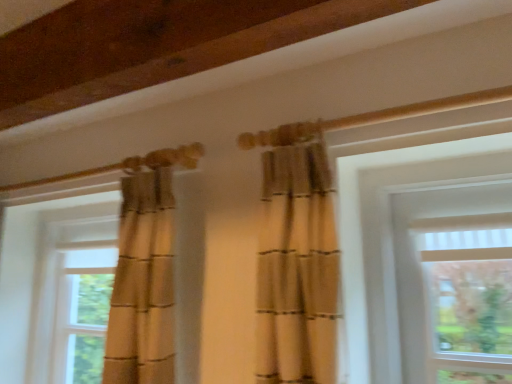
Image resolution: width=512 pixels, height=384 pixels. Describe the element at coordinates (108, 279) in the screenshot. I see `matte beige curtain at left, the 1th window in the right-to-left sequence` at that location.

In order to face matte beige curtain at left, arranged as the second window when viewed from the left, should I rotate leftwards or rightwards?

Turn left by 22.619 degrees to look at matte beige curtain at left, arranged as the second window when viewed from the left.

At what (x,y) coordinates should I click in order to perform the action: click on matte beige curtain at left, arranged as the second window when viewed from the left. Please return your answer as a coordinate pair (x, y). Looking at the image, I should click on (108, 279).

What is the approximate width of matte beige curtain at left, the 1th window in the right-to-left sequence?

matte beige curtain at left, the 1th window in the right-to-left sequence, is 11.33 inches wide.

What is the approximate height of translucent glass window at left, the 2th window viewed from the right?

It is 26.73 inches.

The width and height of the screenshot is (512, 384). I want to click on translucent glass window at left, the 2th window viewed from the right, so click(82, 310).

Image resolution: width=512 pixels, height=384 pixels. What do you see at coordinates (82, 310) in the screenshot?
I see `translucent glass window at left, the 2th window viewed from the right` at bounding box center [82, 310].

Measure the distance between point (80, 269) and camera.

The distance of point (80, 269) from camera is 6.01 feet.

At what (x,y) coordinates should I click in order to perform the action: click on matte beige curtain at left, the 1th window in the right-to-left sequence. Please return your answer as a coordinate pair (x, y). This screenshot has height=384, width=512. Looking at the image, I should click on (108, 279).

Which is more to the left, translucent glass window at left, arranged as the first window when viewed from the left, or matte beige curtain at left, arranged as the second window when viewed from the left?

Positioned to the left is translucent glass window at left, arranged as the first window when viewed from the left.

Which object is further away from the camera, translucent glass window at left, arranged as the first window when viewed from the left, or matte beige curtain at left, the 1th window in the right-to-left sequence?

translucent glass window at left, arranged as the first window when viewed from the left, is further away from the camera.

Is point (91, 313) positioned after point (181, 208)?

Yes, it is behind point (181, 208).

From the image's perspective, is translucent glass window at left, arranged as the first window when viewed from the left, positioned above or below matte beige curtain at left, arranged as the second window when viewed from the left?

translucent glass window at left, arranged as the first window when viewed from the left, is situated lower than matte beige curtain at left, arranged as the second window when viewed from the left, in the image.

From a real-world perspective, which object rests below the other?

translucent glass window at left, the 2th window viewed from the right, from a real-world perspective.

Considering the sizes of objects translucent glass window at left, the 2th window viewed from the right, and matte beige curtain at left, the 1th window in the right-to-left sequence, in the image provided, who is wider, translucent glass window at left, the 2th window viewed from the right, or matte beige curtain at left, the 1th window in the right-to-left sequence,?

Wider between the two is matte beige curtain at left, the 1th window in the right-to-left sequence.

Based on the photo, in terms of height, does translucent glass window at left, arranged as the first window when viewed from the left, look taller or shorter compared to matte beige curtain at left, arranged as the second window when viewed from the left?

Considering their sizes, translucent glass window at left, arranged as the first window when viewed from the left, has less height than matte beige curtain at left, arranged as the second window when viewed from the left.

Does translucent glass window at left, the 2th window viewed from the right, have a smaller size compared to matte beige curtain at left, arranged as the second window when viewed from the left?

Yes, translucent glass window at left, the 2th window viewed from the right, is smaller than matte beige curtain at left, arranged as the second window when viewed from the left.

Is matte beige curtain at left, the 1th window in the right-to-left sequence, surrounded by translucent glass window at left, arranged as the first window when viewed from the left?

No.

Is translucent glass window at left, arranged as the first window when viewed from the left, beside matte beige curtain at left, arranged as the second window when viewed from the left?

No, translucent glass window at left, arranged as the first window when viewed from the left, is not in contact with matte beige curtain at left, arranged as the second window when viewed from the left.

Could you tell me if translucent glass window at left, arranged as the first window when viewed from the left, is facing matte beige curtain at left, arranged as the second window when viewed from the left?

Yes, translucent glass window at left, arranged as the first window when viewed from the left, is oriented towards matte beige curtain at left, arranged as the second window when viewed from the left.

How many degrees apart are the facing directions of translucent glass window at left, arranged as the first window when viewed from the left, and matte beige curtain at left, the 1th window in the right-to-left sequence?

The angle between the facing direction of translucent glass window at left, arranged as the first window when viewed from the left, and the facing direction of matte beige curtain at left, the 1th window in the right-to-left sequence, is 0.849 degrees.

The height and width of the screenshot is (384, 512). Identify the location of window on the left of matte beige curtain at left, the 1th window in the right-to-left sequence. (82, 310).

Is matte beige curtain at left, arranged as the second window when viewed from the left, to the left or to the right of translucent glass window at left, arranged as the first window when viewed from the left, in the image?

From the image, it's evident that matte beige curtain at left, arranged as the second window when viewed from the left, is to the right of translucent glass window at left, arranged as the first window when viewed from the left.

Is matte beige curtain at left, arranged as the second window when viewed from the left, positioned before translucent glass window at left, arranged as the first window when viewed from the left?

Yes, matte beige curtain at left, arranged as the second window when viewed from the left, is closer to the viewer.

Does point (132, 382) lie behind point (87, 382)?

No.

From the image's perspective, is matte beige curtain at left, arranged as the second window when viewed from the left, above translucent glass window at left, arranged as the first window when viewed from the left?

Yes, from the image's perspective, matte beige curtain at left, arranged as the second window when viewed from the left, is on top of translucent glass window at left, arranged as the first window when viewed from the left.

From a real-world perspective, is matte beige curtain at left, arranged as the second window when viewed from the left, physically above translucent glass window at left, the 2th window viewed from the right?

Yes, from a real-world perspective, matte beige curtain at left, arranged as the second window when viewed from the left, is above translucent glass window at left, the 2th window viewed from the right.

Which object is wider, matte beige curtain at left, the 1th window in the right-to-left sequence, or translucent glass window at left, arranged as the first window when viewed from the left?

matte beige curtain at left, the 1th window in the right-to-left sequence, is wider.

Which of these two, matte beige curtain at left, the 1th window in the right-to-left sequence, or translucent glass window at left, the 2th window viewed from the right, stands taller?

matte beige curtain at left, the 1th window in the right-to-left sequence, is taller.

Based on the photo, which of these two, matte beige curtain at left, arranged as the second window when viewed from the left, or translucent glass window at left, the 2th window viewed from the right, is bigger?

matte beige curtain at left, arranged as the second window when viewed from the left, is bigger.

Could translucent glass window at left, the 2th window viewed from the right, be considered to be inside matte beige curtain at left, arranged as the second window when viewed from the left?

Yes, translucent glass window at left, the 2th window viewed from the right, can be found within matte beige curtain at left, arranged as the second window when viewed from the left.

From the picture: Is matte beige curtain at left, arranged as the second window when viewed from the left, touching translucent glass window at left, arranged as the first window when viewed from the left?

→ No, matte beige curtain at left, arranged as the second window when viewed from the left, is not in contact with translucent glass window at left, arranged as the first window when viewed from the left.

Is matte beige curtain at left, the 1th window in the right-to-left sequence, positioned with its back to translucent glass window at left, arranged as the first window when viewed from the left?

That's right, matte beige curtain at left, the 1th window in the right-to-left sequence, is facing away from translucent glass window at left, arranged as the first window when viewed from the left.

Measure the distance between matte beige curtain at left, the 1th window in the right-to-left sequence, and translucent glass window at left, arranged as the first window when viewed from the left.

13.07 centimeters.

This screenshot has width=512, height=384. In order to click on window to the left of matte beige curtain at left, arranged as the second window when viewed from the left in this screenshot , I will do pyautogui.click(x=82, y=310).

You are a GUI agent. You are given a task and a screenshot of the screen. Output one action in this format:
    pyautogui.click(x=<x>, y=<y>)
    Task: Click on the window on the right of translucent glass window at left, arranged as the first window when viewed from the left
    This screenshot has height=384, width=512.
    Given the screenshot: What is the action you would take?
    pyautogui.click(x=108, y=279)

Image resolution: width=512 pixels, height=384 pixels. Find the location of `window lying on the left of matte beige curtain at left, the 1th window in the right-to-left sequence`. window lying on the left of matte beige curtain at left, the 1th window in the right-to-left sequence is located at coordinates (82, 310).